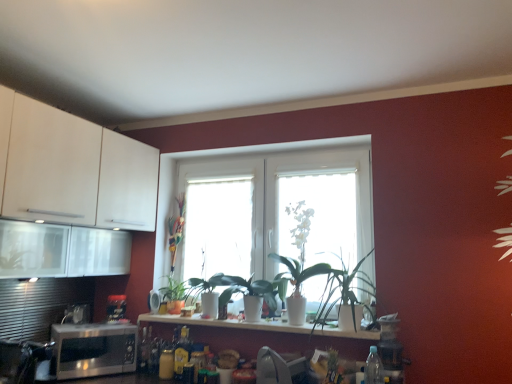
Question: In which direction should I rotate to look at green matte plant at center, positioned as the 2th plant in left-to-right order?

Choices:
 (A) left
 (B) right

Answer: (A)

Question: Considering the relative sizes of multicolored plastic plant at center, which appears as the 1th plant when viewed from the left, and green matte plant at center, which appears as the 5th plant when viewed from the left, in the image provided, is multicolored plastic plant at center, which appears as the 1th plant when viewed from the left, wider than green matte plant at center, which appears as the 5th plant when viewed from the left,?

Choices:
 (A) yes
 (B) no

Answer: (B)

Question: Are multicolored plastic plant at center, which is the fifth plant in right-to-left order, and green matte plant at center, which appears as the 5th plant when viewed from the left, making contact?

Choices:
 (A) yes
 (B) no

Answer: (B)

Question: Considering the relative sizes of multicolored plastic plant at center, which appears as the 1th plant when viewed from the left, and green matte plant at center, which appears as the 5th plant when viewed from the left, in the image provided, is multicolored plastic plant at center, which appears as the 1th plant when viewed from the left, thinner than green matte plant at center, which appears as the 5th plant when viewed from the left,?

Choices:
 (A) no
 (B) yes

Answer: (B)

Question: From the image's perspective, is multicolored plastic plant at center, which appears as the 1th plant when viewed from the left, beneath green matte plant at center, positioned as the first plant in right-to-left order?

Choices:
 (A) yes
 (B) no

Answer: (B)

Question: Is multicolored plastic plant at center, which is the fifth plant in right-to-left order, positioned with its back to green matte plant at center, which appears as the 5th plant when viewed from the left?

Choices:
 (A) no
 (B) yes

Answer: (A)

Question: Is multicolored plastic plant at center, which is the fifth plant in right-to-left order, not within green matte plant at center, positioned as the first plant in right-to-left order?

Choices:
 (A) no
 (B) yes

Answer: (B)

Question: Considering the relative sizes of green matte plant at center, the 4th plant when ordered from right to left, and white glossy vase at center, which ranks as the 1th window in right-to-left order, in the image provided, is green matte plant at center, the 4th plant when ordered from right to left, thinner than white glossy vase at center, which ranks as the 1th window in right-to-left order,?

Choices:
 (A) yes
 (B) no

Answer: (B)

Question: Considering the relative positions of green matte plant at center, the 4th plant when ordered from right to left, and white glossy vase at center, the 3th window in the left-to-right sequence, in the image provided, is green matte plant at center, the 4th plant when ordered from right to left, to the right of white glossy vase at center, the 3th window in the left-to-right sequence, from the viewer's perspective?

Choices:
 (A) yes
 (B) no

Answer: (B)

Question: Can we say green matte plant at center, positioned as the 2th plant in left-to-right order, lies outside white glossy vase at center, the 3th window in the left-to-right sequence?

Choices:
 (A) yes
 (B) no

Answer: (A)

Question: Does green matte plant at center, the 4th plant when ordered from right to left, contain white glossy vase at center, which ranks as the 1th window in right-to-left order?

Choices:
 (A) yes
 (B) no

Answer: (B)

Question: Is green matte plant at center, the 4th plant when ordered from right to left, positioned before white glossy vase at center, which ranks as the 1th window in right-to-left order?

Choices:
 (A) no
 (B) yes

Answer: (A)

Question: Is white glossy countertop at center aimed at white glossy vase at center, the second plant viewed from the right?

Choices:
 (A) no
 (B) yes

Answer: (A)